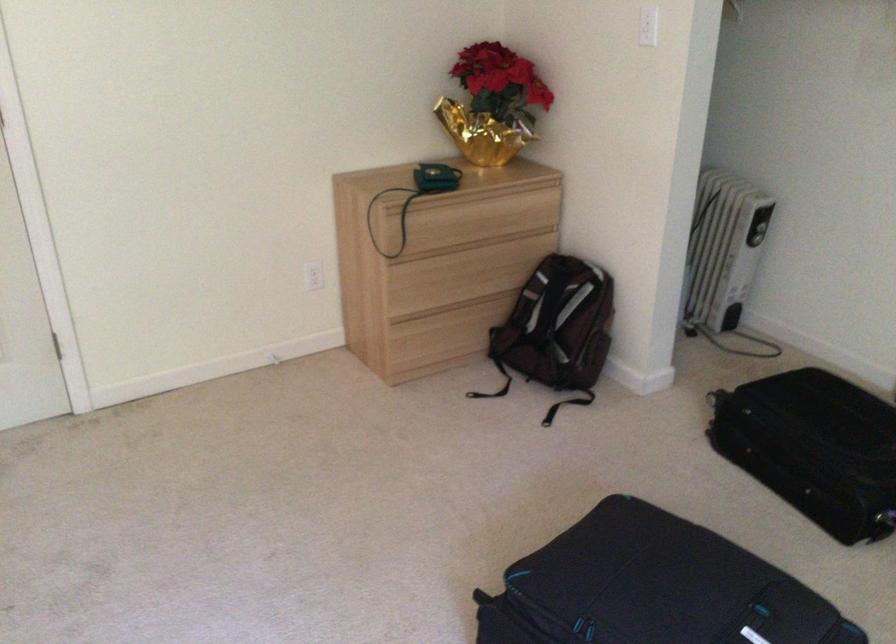
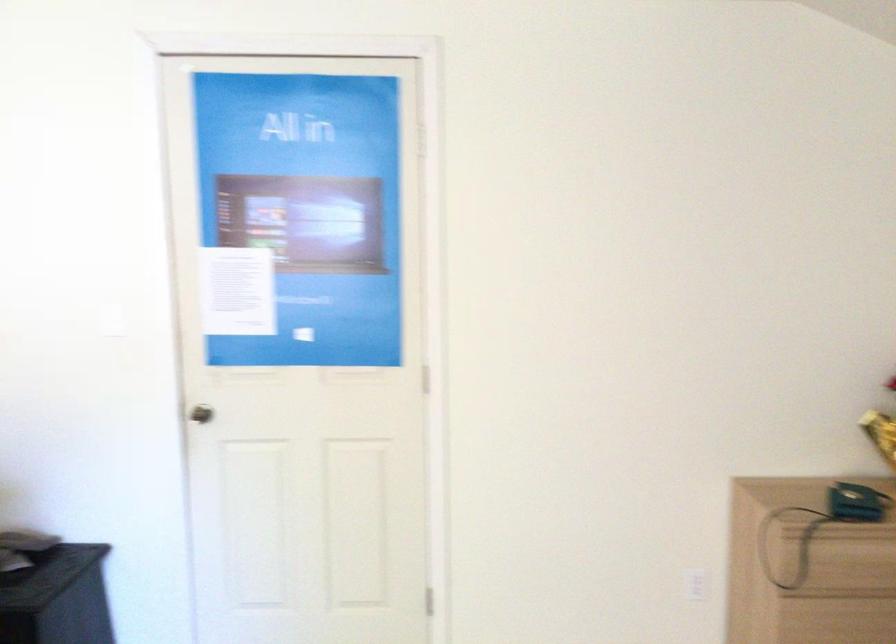
First-person continuous shooting, in which direction is the camera rotating?

The rotation direction of the camera is left-up.